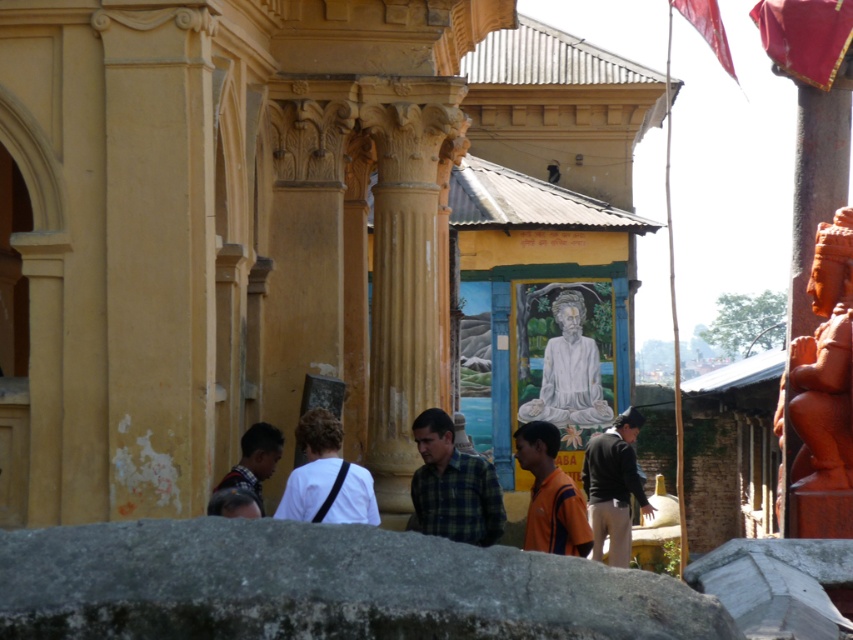
Question: Based on their relative distances, which object is nearer to the dark brown leather jacket at center?

Choices:
 (A) white marble statue at center
 (B) dark brown shirt at lower left

Answer: (A)

Question: Which point is closer to the camera taking this photo?

Choices:
 (A) (570, 305)
 (B) (817, 522)
 (C) (567, 534)

Answer: (B)

Question: Which of the following is the farthest from the observer?

Choices:
 (A) (456, 465)
 (B) (235, 483)
 (C) (599, 524)

Answer: (C)

Question: Can you confirm if matte orange statue at right is smaller than white marble statue at center?

Choices:
 (A) yes
 (B) no

Answer: (B)

Question: Does matte orange statue at right appear over dark brown shirt at lower left?

Choices:
 (A) yes
 (B) no

Answer: (A)

Question: Can you confirm if matte orange statue at right is bigger than dark brown shirt at lower left?

Choices:
 (A) yes
 (B) no

Answer: (A)